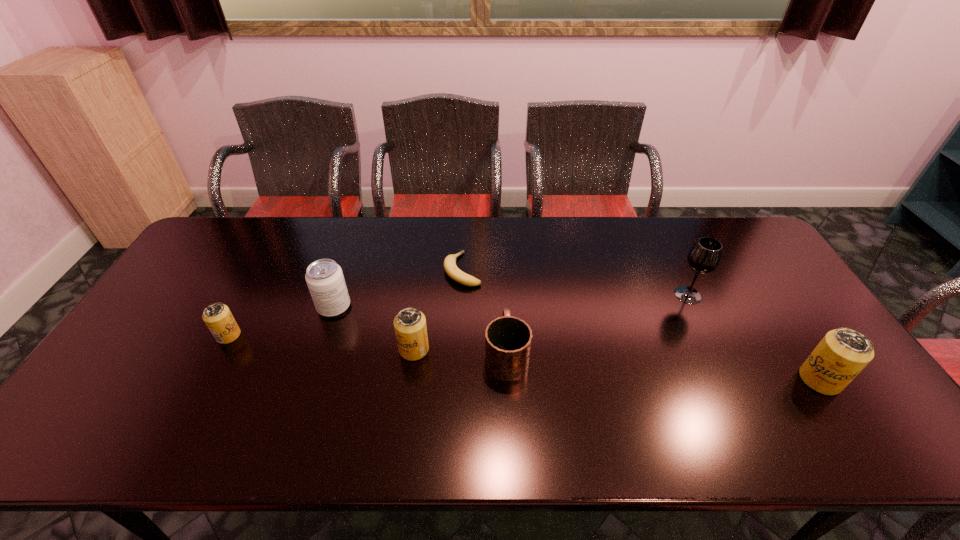
Image resolution: width=960 pixels, height=540 pixels. I want to click on free space at the far right corner, so click(x=729, y=237).

Where is `vacant space that's between the rightmost object and the second tallest beer can`? The image size is (960, 540). vacant space that's between the rightmost object and the second tallest beer can is located at coordinates (617, 364).

In order to click on vacant point located between the banana and the second beer can from right to left in this screenshot , I will do `click(439, 309)`.

Identify the location of vacant point located between the fifth object from left to right and the leftmost beer can. (368, 344).

Find the location of a particular element. The image size is (960, 540). vacant region between the third object from right to left and the wineglass is located at coordinates (597, 324).

The height and width of the screenshot is (540, 960). Identify the location of vacant region between the third object from right to left and the shortest beer can. (368, 344).

Find the location of a particular element. The height and width of the screenshot is (540, 960). free point between the second object from left to right and the fourth object from right to left is located at coordinates (398, 288).

This screenshot has height=540, width=960. Find the location of `vacant area that lies between the soda can and the shortest object`. vacant area that lies between the soda can and the shortest object is located at coordinates (398, 288).

Where is `object that is the second closest to the leftmost beer can`? The height and width of the screenshot is (540, 960). object that is the second closest to the leftmost beer can is located at coordinates (410, 327).

Identify which object is located as the nearest to the tallest object. Please provide its 2D coordinates. Your answer should be formatted as a tuple, i.e. [(x, y)], where the tuple contains the x and y coordinates of a point satisfying the conditions above.

[(843, 353)]